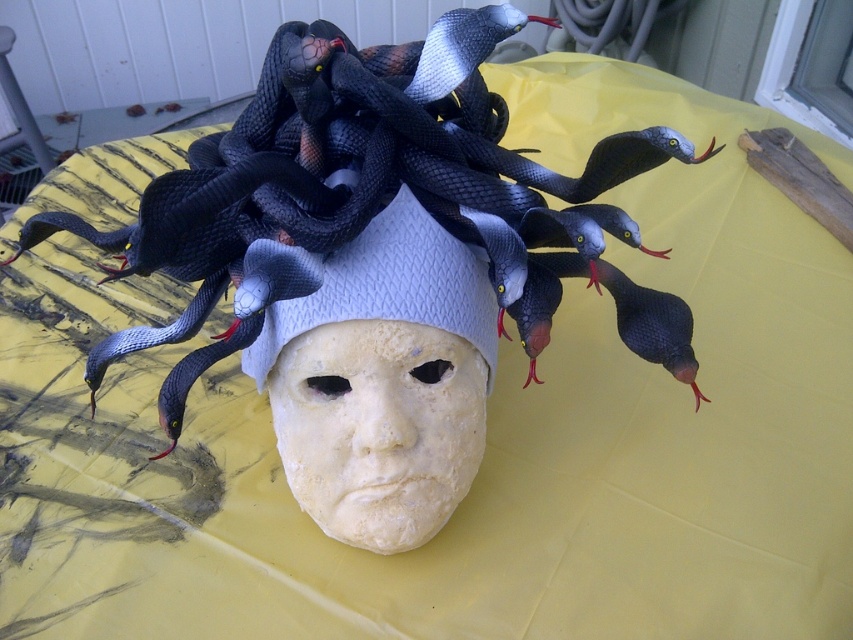
Question: Is black matte snakes at center in front of white matte headdress at center?

Choices:
 (A) no
 (B) yes

Answer: (B)

Question: Does black matte snakes at center have a lesser width compared to white matte headdress at center?

Choices:
 (A) no
 (B) yes

Answer: (A)

Question: Which point is closer to the camera?

Choices:
 (A) (471, 266)
 (B) (331, 35)

Answer: (B)

Question: Where is black matte snakes at center located in relation to white matte headdress at center in the image?

Choices:
 (A) below
 (B) above

Answer: (B)